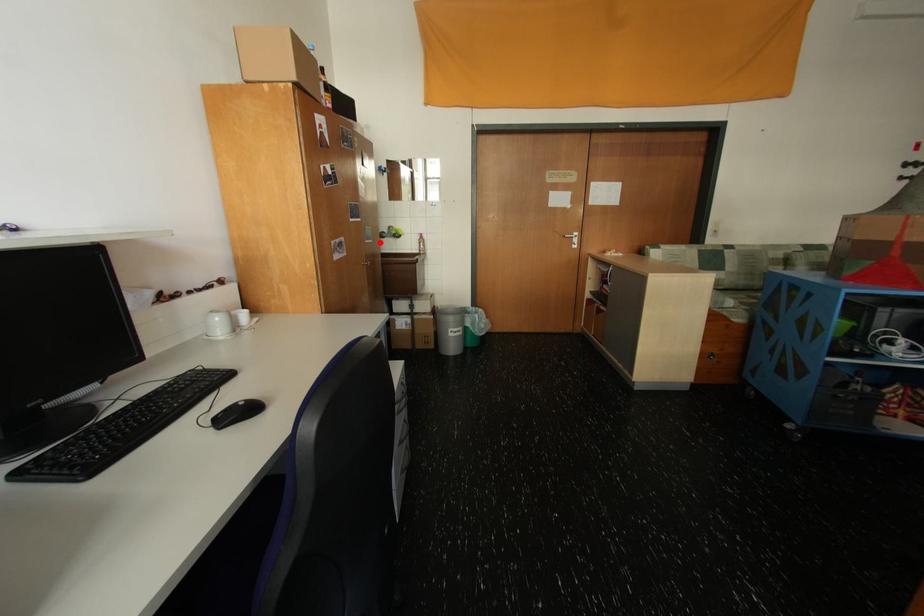
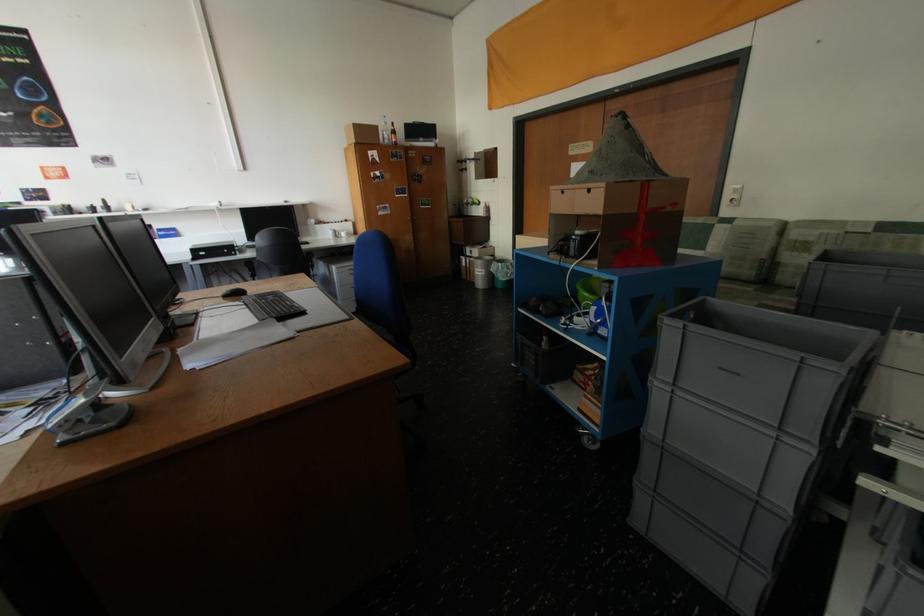
Question: I am providing you with two images of the same scene from different viewpoints. A red point is marked on the first image. Is the red point's position out of view in image 2?

Choices:
 (A) Yes
 (B) No

Answer: (B)